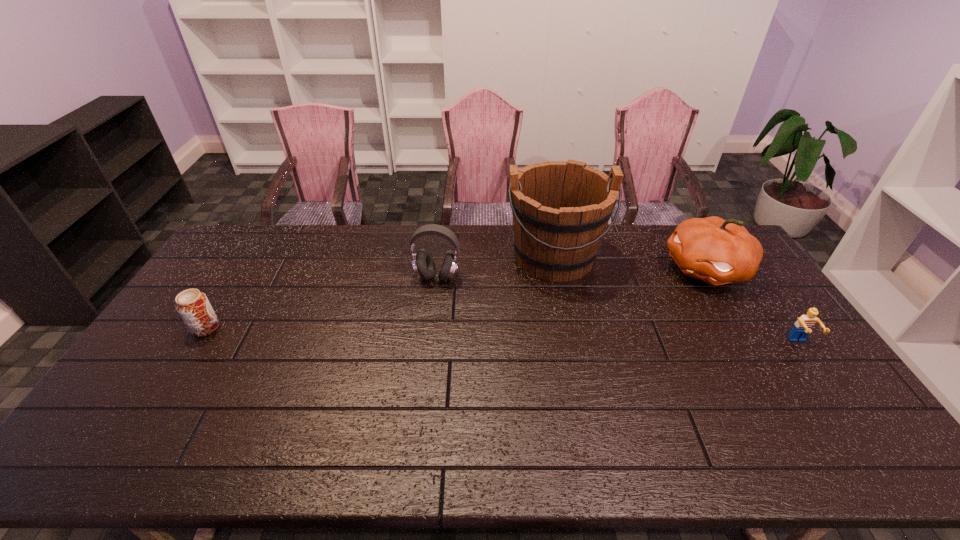
The width and height of the screenshot is (960, 540). What are the coordinates of `unoccupied area between the Lego and the pumpkin` in the screenshot? It's located at (753, 306).

This screenshot has width=960, height=540. What are the coordinates of `unoccupied position between the leftmost object and the second object from left to right` in the screenshot? It's located at (322, 302).

The image size is (960, 540). Find the location of `free space between the tallest object and the Lego`. free space between the tallest object and the Lego is located at coordinates (677, 299).

Identify the location of empty space that is in between the Lego and the third object from right to left. (677, 299).

This screenshot has width=960, height=540. I want to click on free space between the Lego and the leftmost object, so click(x=502, y=335).

You are a GUI agent. You are given a task and a screenshot of the screen. Output one action in this format:
    pyautogui.click(x=<x>, y=<y>)
    Task: Click on the vacant region between the third object from left to right and the pumpkin
    
    Given the screenshot: What is the action you would take?
    pyautogui.click(x=630, y=262)

Identify the location of free space between the leftmost object and the Lego. (502, 335).

Select which object appears as the second closest to the Lego. Please provide its 2D coordinates. Your answer should be formatted as a tuple, i.e. [(x, y)], where the tuple contains the x and y coordinates of a point satisfying the conditions above.

[(561, 209)]

Find the location of a particular element. object that is the closest to the headset is located at coordinates (561, 209).